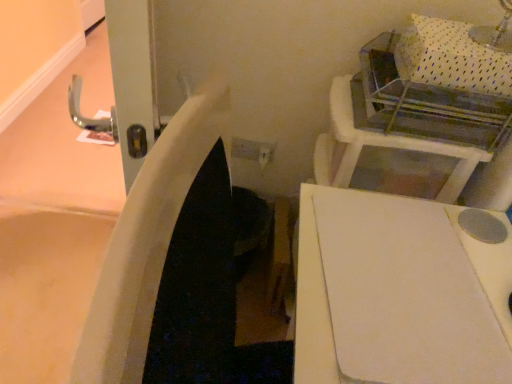
I want to click on vacant space underneath white matte cutting board at center (from a real-world perspective), so click(402, 273).